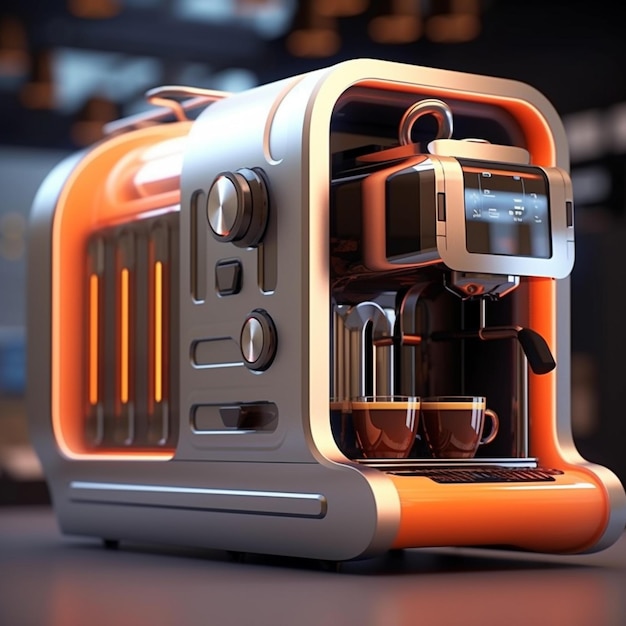
Find the location of a particular element. stands is located at coordinates (109, 73), (106, 546), (403, 553).